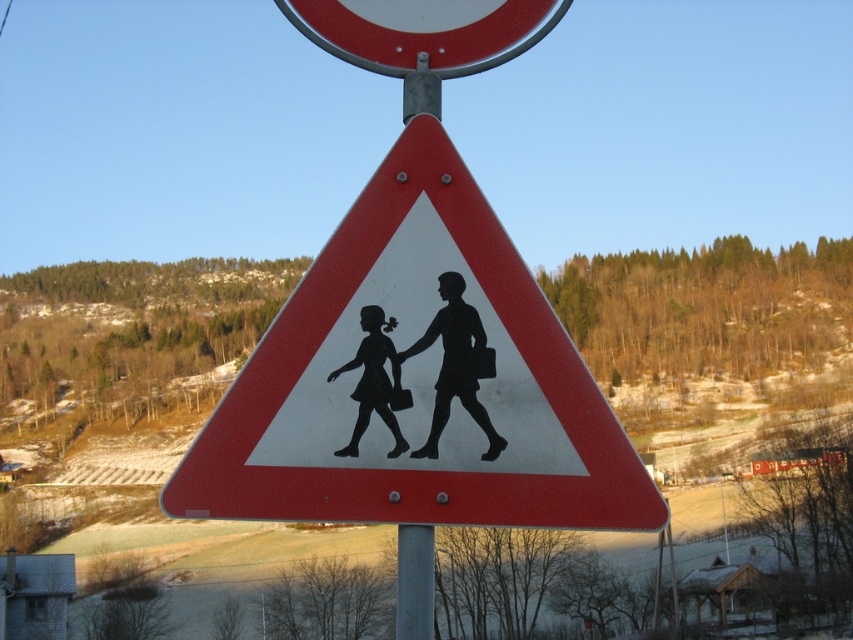
Who is lower down, white paper triangle at center or smooth metal circle at upper center?

white paper triangle at center is lower down.

Is point (508, 435) farther from viewer compared to point (347, 36)?

No.

The width and height of the screenshot is (853, 640). Identify the location of white paper triangle at center. (416, 381).